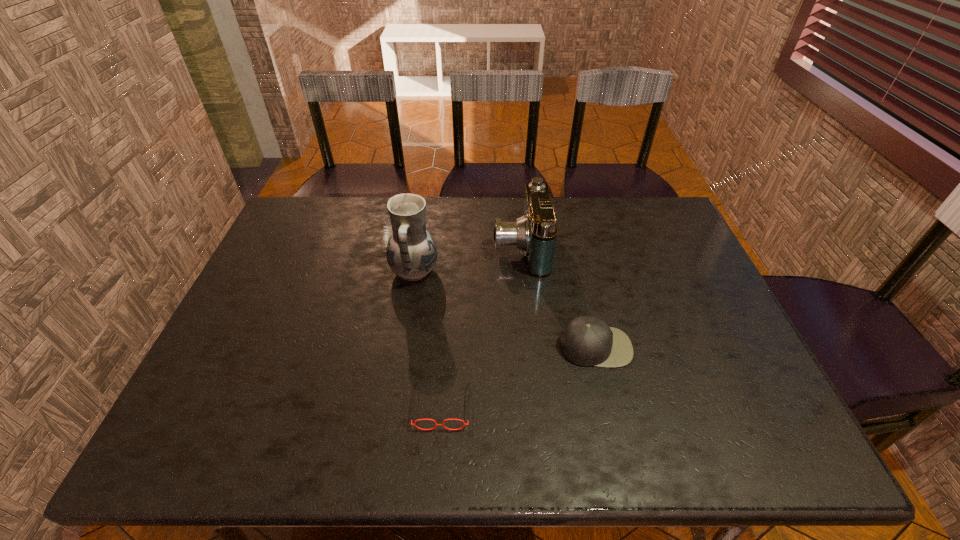
Identify the location of free location located 0.170m on the brim of the third tallest object. Image resolution: width=960 pixels, height=540 pixels. [615, 435].

Locate an element on the screen. The height and width of the screenshot is (540, 960). object positioned at the far edge is located at coordinates (535, 233).

You are a GUI agent. You are given a task and a screenshot of the screen. Output one action in this format:
    pyautogui.click(x=<x>, y=<y>)
    Task: Click on the object at the near edge
    The image size is (960, 540).
    Given the screenshot: What is the action you would take?
    pyautogui.click(x=436, y=424)

In the image, there is a desktop. Where is `free space at the far edge`? free space at the far edge is located at coordinates (623, 215).

Where is `vacant space at the near edge of the desktop`? This screenshot has width=960, height=540. vacant space at the near edge of the desktop is located at coordinates (473, 427).

The height and width of the screenshot is (540, 960). Find the location of `free space at the left edge of the desktop`. free space at the left edge of the desktop is located at coordinates (x=265, y=363).

Where is `vacant space at the right edge of the desktop`? The image size is (960, 540). vacant space at the right edge of the desktop is located at coordinates (715, 321).

The image size is (960, 540). In order to click on vacant space at the far right corner in this screenshot , I will do `click(663, 213)`.

At what (x,y) coordinates should I click in order to perform the action: click on vacant space that is in between the pitcher and the camcorder. Please return your answer as a coordinate pair (x, y). The width and height of the screenshot is (960, 540). Looking at the image, I should click on (468, 259).

The width and height of the screenshot is (960, 540). What are the coordinates of `vacant area between the nearest object and the camcorder` in the screenshot? It's located at (481, 326).